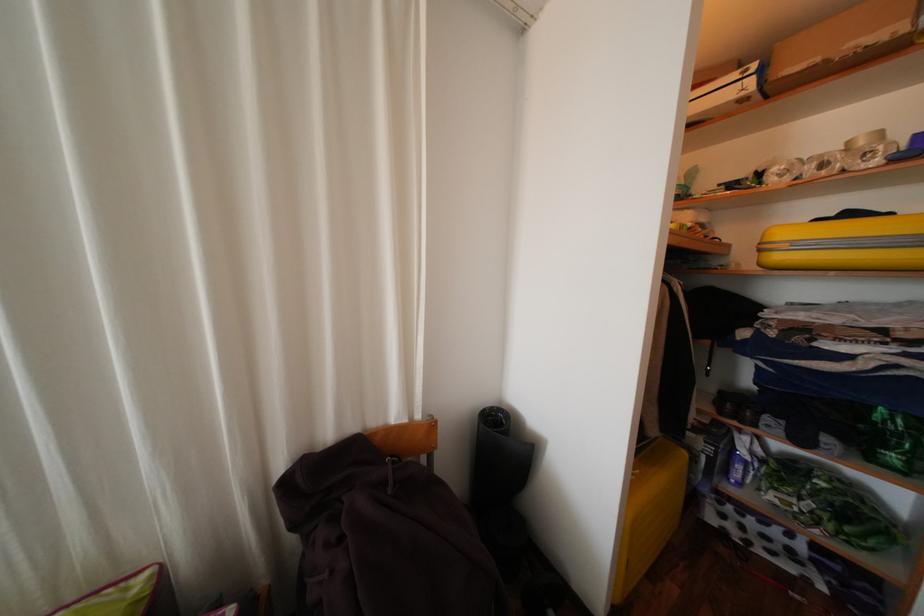
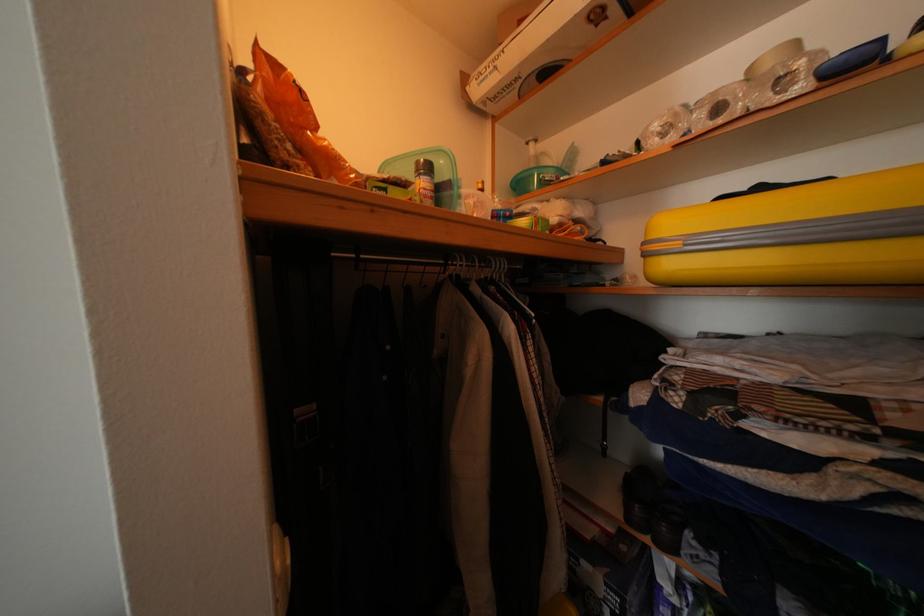
Question: How did the camera likely rotate?

Choices:
 (A) Left
 (B) Right
 (C) Up
 (D) Down

Answer: (B)